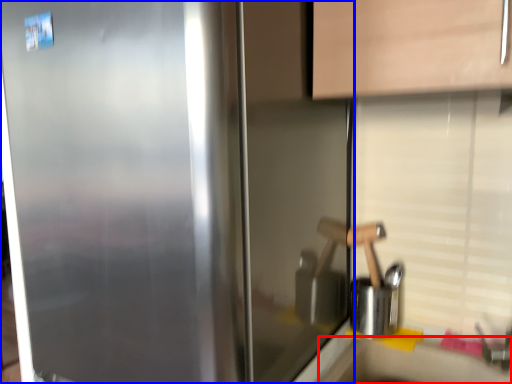
Question: Which object is closer to the camera taking this photo, counter top (highlighted by a red box) or refrigerator (highlighted by a blue box)?

Choices:
 (A) counter top
 (B) refrigerator

Answer: (B)